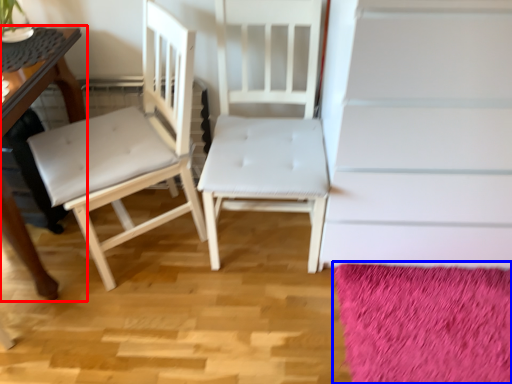
Question: Which object appears farthest to the camera in this image, table (highlighted by a red box) or mat (highlighted by a blue box)?

Choices:
 (A) table
 (B) mat

Answer: (B)